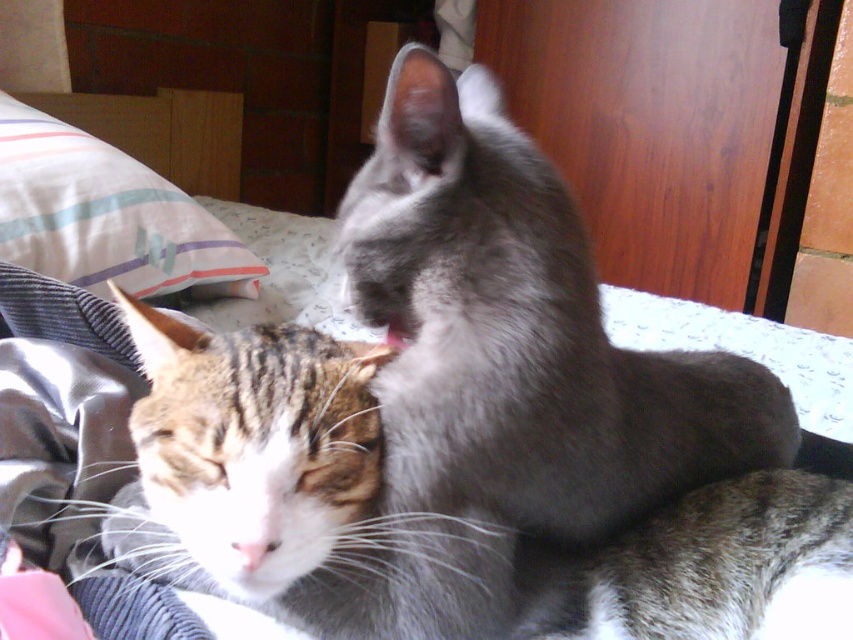
Question: Which point is closer to the camera?

Choices:
 (A) gray fluffy cat at center
 (B) white striped fabric at upper left

Answer: (A)

Question: Is gray fluffy cat at center closer to camera compared to tabby fur cat at center?

Choices:
 (A) no
 (B) yes

Answer: (A)

Question: Which point is farther to the camera?

Choices:
 (A) gray fluffy cat at center
 (B) white striped fabric at upper left
 (C) tabby fur cat at center

Answer: (B)

Question: Is gray fluffy cat at center to the left of white striped fabric at upper left from the viewer's perspective?

Choices:
 (A) yes
 (B) no

Answer: (B)

Question: Among these objects, which one is farthest from the camera?

Choices:
 (A) gray fluffy cat at center
 (B) white striped fabric at upper left
 (C) tabby fur cat at center

Answer: (B)

Question: Is gray fluffy cat at center to the right of tabby fur cat at center from the viewer's perspective?

Choices:
 (A) yes
 (B) no

Answer: (A)